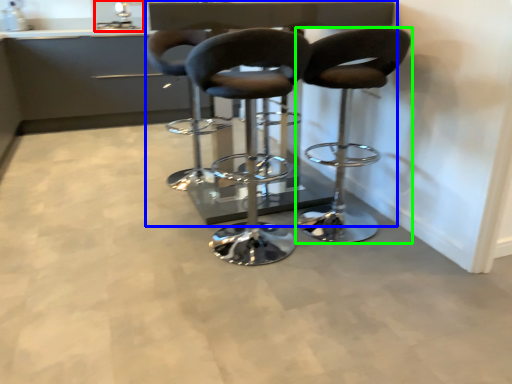
Question: Estimate the real-world distances between objects in this image. Which object is farther from sink (highlighted by a red box), table (highlighted by a blue box) or chair (highlighted by a green box)?

Choices:
 (A) table
 (B) chair

Answer: (B)